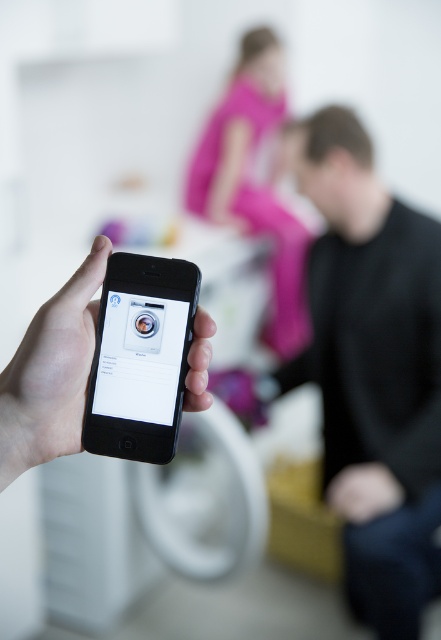
You are organizing a charity clothing drive and need to determine which item takes up more space in the donation box. Based on the image, which item is larger in size between the black matte shirt at right and the pink fabric pants at upper center?

The pink fabric pants at upper center are larger in size than the black matte shirt at right, so they will take up more space in the donation box.